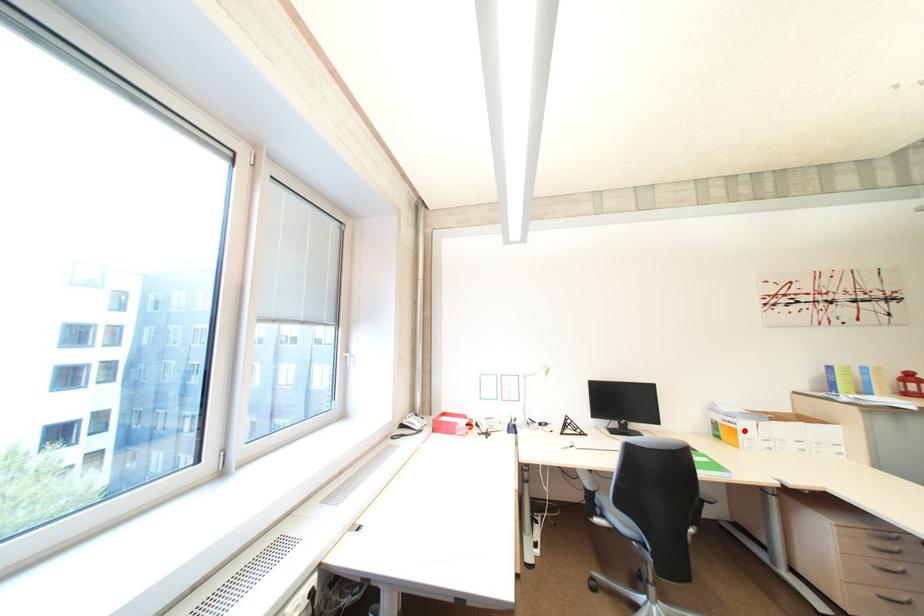
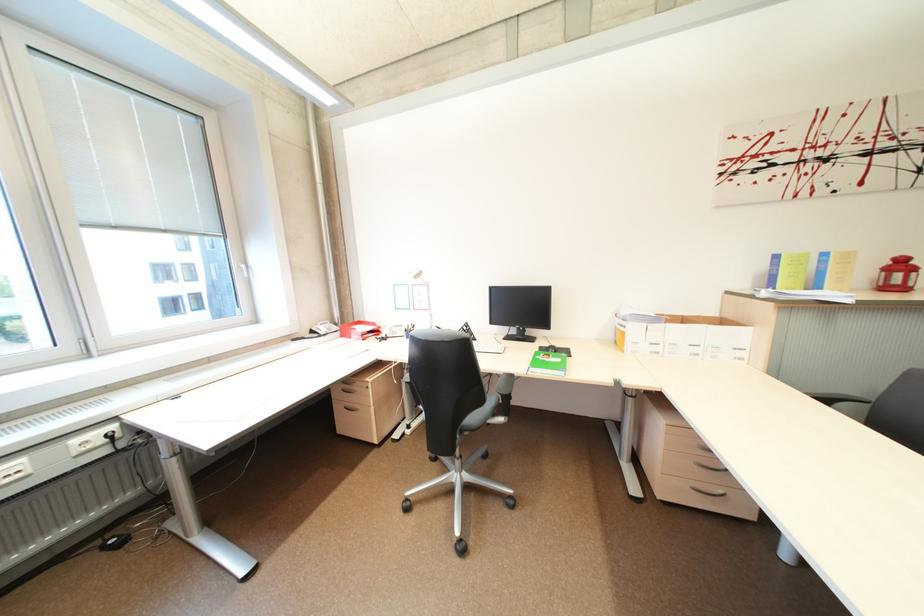
Question: I am providing you with two images of the same scene from different viewpoints. A red point is marked on the first image. Is the red point's position out of view in image 2?

Choices:
 (A) Yes
 (B) No

Answer: (B)